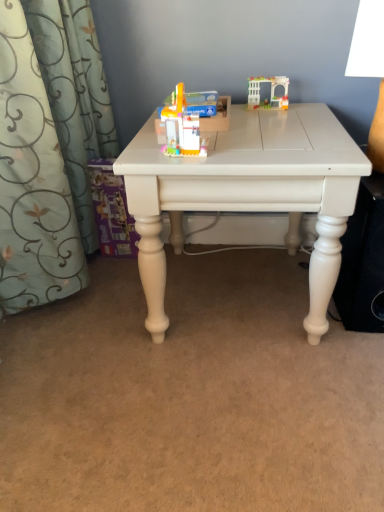
Question: Considering the relative sizes of white plastic lampshade at upper right and white matte table at center in the image provided, is white plastic lampshade at upper right taller than white matte table at center?

Choices:
 (A) no
 (B) yes

Answer: (A)

Question: From the image's perspective, does white plastic lampshade at upper right appear lower than white matte table at center?

Choices:
 (A) yes
 (B) no

Answer: (B)

Question: Is white plastic lampshade at upper right positioned behind white matte table at center?

Choices:
 (A) no
 (B) yes

Answer: (A)

Question: Would you say white plastic lampshade at upper right is outside white matte table at center?

Choices:
 (A) yes
 (B) no

Answer: (A)

Question: Is white plastic lampshade at upper right looking in the opposite direction of white matte table at center?

Choices:
 (A) yes
 (B) no

Answer: (B)

Question: From the image's perspective, relative to translucent plastic archway at upper right, arranged as the second toy when viewed from the left, is translucent plastic toy at center, marked as the first toy in a left-to-right arrangement, above or below?

Choices:
 (A) below
 (B) above

Answer: (A)

Question: Is translucent plastic toy at center, which is the second toy from back to front, in front of or behind translucent plastic archway at upper right, the 1th toy from the back, in the image?

Choices:
 (A) front
 (B) behind

Answer: (A)

Question: Is translucent plastic toy at center, which appears as the 1th toy when ordered from the bottom, inside the boundaries of translucent plastic archway at upper right, arranged as the second toy when viewed from the left, or outside?

Choices:
 (A) inside
 (B) outside

Answer: (B)

Question: Is point (195, 121) positioned closer to the camera than point (283, 100)?

Choices:
 (A) farther
 (B) closer

Answer: (B)

Question: Based on their positions, is translucent plastic toy at center, which is the second toy from back to front, located to the left or right of white matte table at center?

Choices:
 (A) right
 (B) left

Answer: (B)

Question: From a real-world perspective, is translucent plastic toy at center, which appears as the 1th toy when ordered from the bottom, positioned above or below white matte table at center?

Choices:
 (A) above
 (B) below

Answer: (A)

Question: Considering the positions of translucent plastic toy at center, marked as the 2th toy in a right-to-left arrangement, and white matte table at center in the image, is translucent plastic toy at center, marked as the 2th toy in a right-to-left arrangement, wider or thinner than white matte table at center?

Choices:
 (A) wide
 (B) thin

Answer: (B)

Question: Is point (223, 125) positioned closer to the camera than point (210, 155)?

Choices:
 (A) farther
 (B) closer

Answer: (A)

Question: From a real-world perspective, relative to translucent plastic archway at upper right, the 1th toy from the back, is white matte speaker at lower right vertically above or below?

Choices:
 (A) below
 (B) above

Answer: (A)

Question: In terms of size, does white matte speaker at lower right appear bigger or smaller than translucent plastic archway at upper right, which is the 1th toy from top to bottom?

Choices:
 (A) small
 (B) big

Answer: (B)